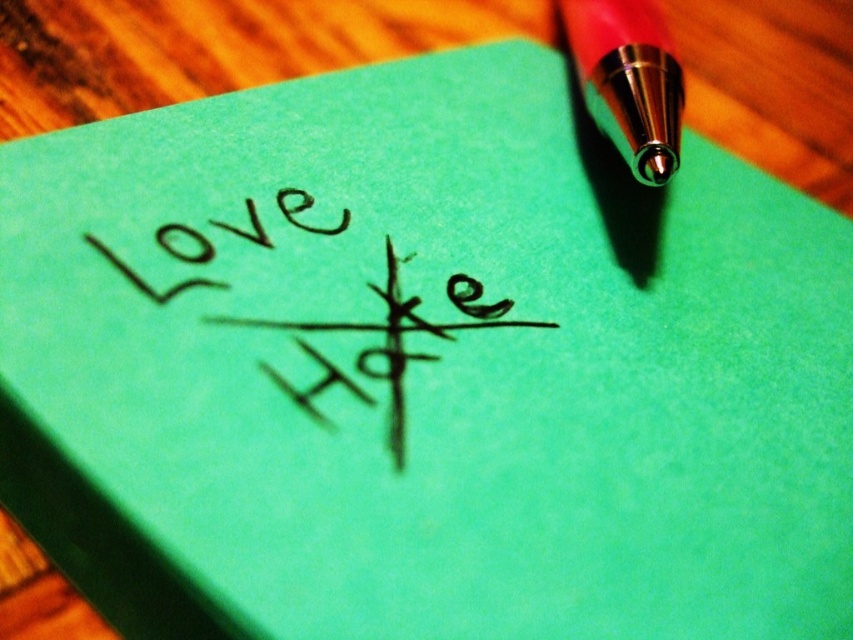
You are holding a ruler and looking at the image. You want to measure the distance between the two points, point (x=387, y=353) and point (x=625, y=12). Which point is closer to you so you can start measuring from there?

Point (x=387, y=353) is closer to the camera than point (x=625, y=12), so you should start measuring from point (x=387, y=353).

You are an artist trying to sketch the scene. You notice the red metallic pen tip at upper right and the matte black writing at upper left. Which object is closer to the viewer?

The red metallic pen tip at upper right is positioned over the matte black writing at upper left, which means it is closer to the viewer.